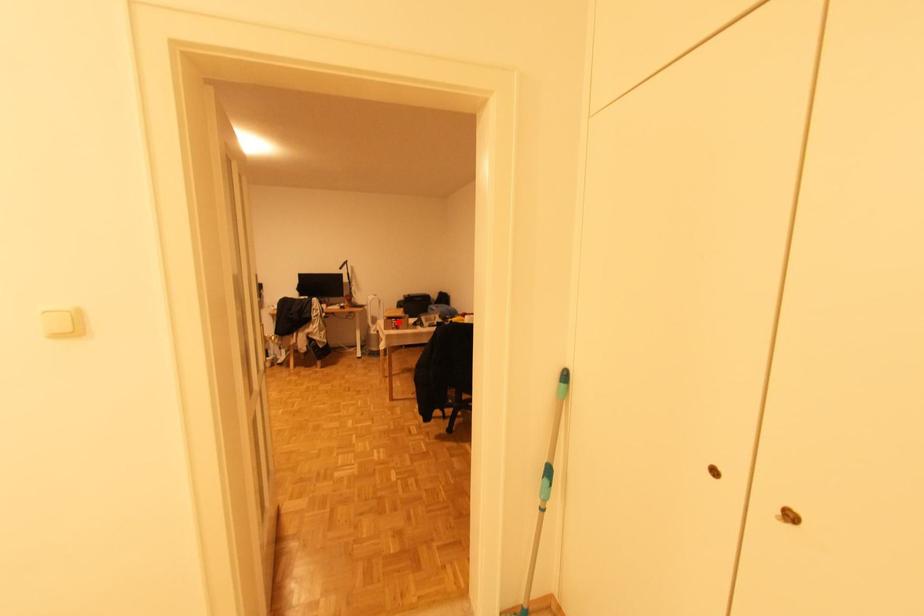
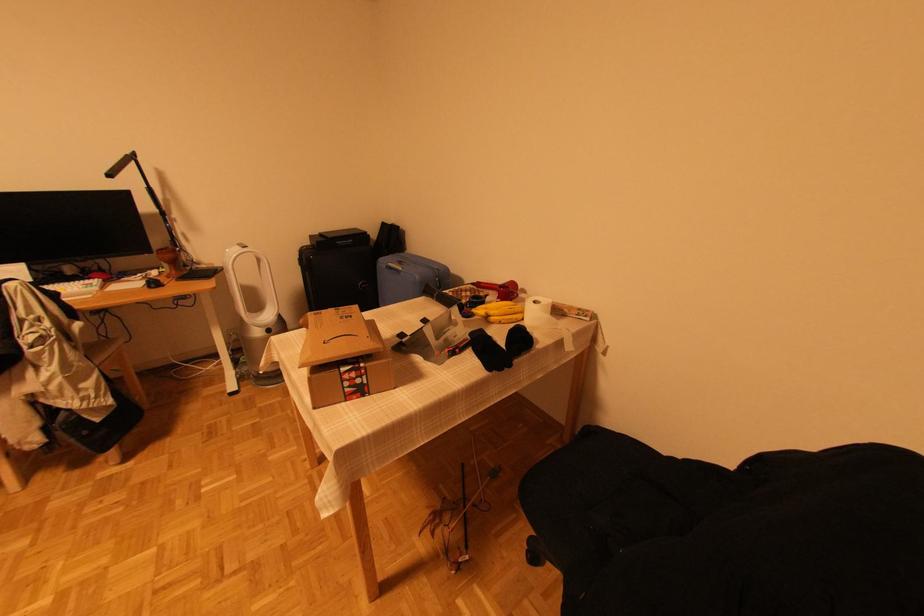
Where in the second image is the point corresponding to the highlighted location from the first image?

(356, 376)